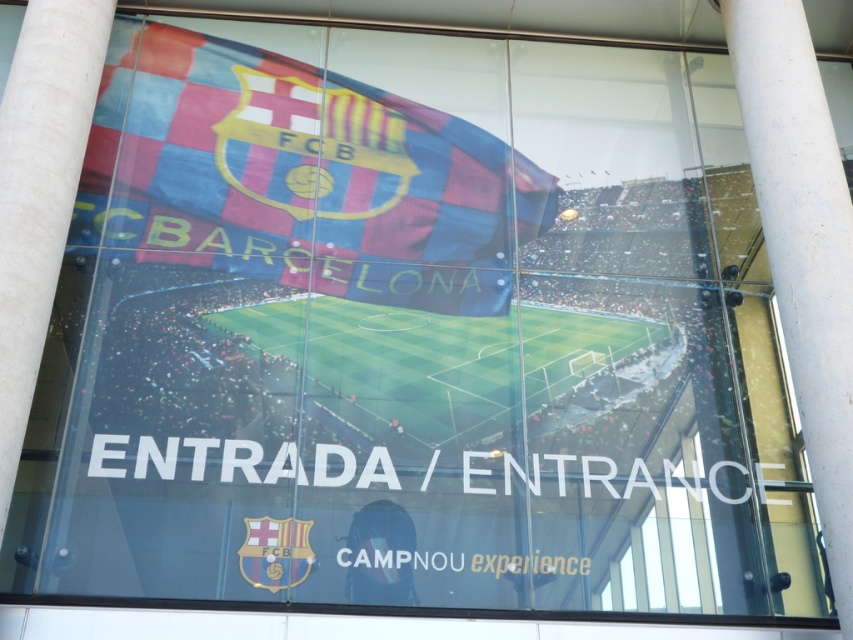
Question: Is polyester flag at center above transparent glass window at center?

Choices:
 (A) yes
 (B) no

Answer: (A)

Question: Which point is farther from the camera taking this photo?

Choices:
 (A) coord(849,422)
 (B) coord(508,172)
 (C) coord(646,568)

Answer: (B)

Question: Which object is farther from the camera taking this photo?

Choices:
 (A) white glossy pillar at right
 (B) polyester flag at center
 (C) transparent glass window at center

Answer: (B)

Question: Which point is farther from the camera taking this photo?

Choices:
 (A) (769, 0)
 (B) (671, 508)

Answer: (A)

Question: Where is white glossy pillar at right located in relation to transparent glass window at center in the image?

Choices:
 (A) below
 (B) above

Answer: (B)

Question: Is polyester flag at center thinner than white glossy pillar at right?

Choices:
 (A) yes
 (B) no

Answer: (B)